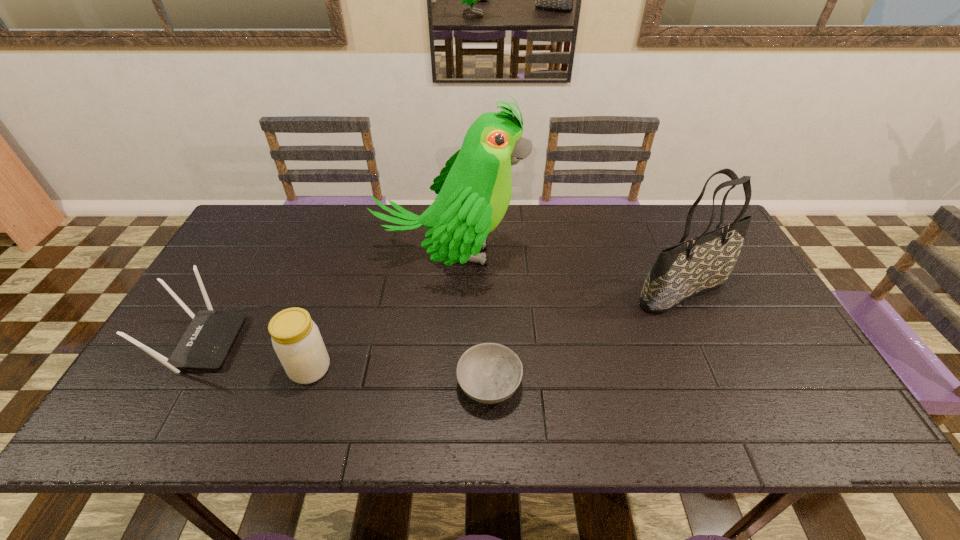
You are a GUI agent. You are given a task and a screenshot of the screen. Output one action in this format:
    pyautogui.click(x=<x>, y=<y>)
    Task: Click on the blank region between the jar and the bowl
    
    Given the screenshot: What is the action you would take?
    pyautogui.click(x=399, y=376)

Locate an element on the screen. vacant area that lies between the parakeet and the shortest object is located at coordinates (470, 320).

Identify which object is located as the nearest to the bowl. Please provide its 2D coordinates. Your answer should be formatted as a tuple, i.e. [(x, y)], where the tuple contains the x and y coordinates of a point satisfying the conditions above.

[(474, 189)]

Select which object is the second closest to the jar. Please provide its 2D coordinates. Your answer should be formatted as a tuple, i.e. [(x, y)], where the tuple contains the x and y coordinates of a point satisfying the conditions above.

[(474, 189)]

Locate an element on the screen. This screenshot has width=960, height=540. vacant space that satisfies the following two spatial constraints: 1. on the back side of the rightmost object; 2. on the beak of the tallest object is located at coordinates (666, 255).

Locate an element on the screen. This screenshot has height=540, width=960. free spot that satisfies the following two spatial constraints: 1. on the back side of the fourth object from right to left; 2. on the front-facing side of the leftmost object is located at coordinates (319, 343).

At what (x,y) coordinates should I click in order to perform the action: click on free spot that satisfies the following two spatial constraints: 1. on the front-facing side of the shortest object; 2. on the left side of the router. Please return your answer as a coordinate pair (x, y). Image resolution: width=960 pixels, height=540 pixels. Looking at the image, I should click on (179, 384).

The image size is (960, 540). I want to click on vacant position in the image that satisfies the following two spatial constraints: 1. on the front side of the tote bag; 2. on the front-facing side of the leftmost object, so click(707, 343).

Where is `vacant space that satisfies the following two spatial constraints: 1. on the beak of the shortest object; 2. on the left side of the parakeet`? vacant space that satisfies the following two spatial constraints: 1. on the beak of the shortest object; 2. on the left side of the parakeet is located at coordinates (442, 384).

The width and height of the screenshot is (960, 540). In order to click on free space that satisfies the following two spatial constraints: 1. on the beak of the parakeet; 2. on the front side of the jar in this screenshot , I will do `click(443, 369)`.